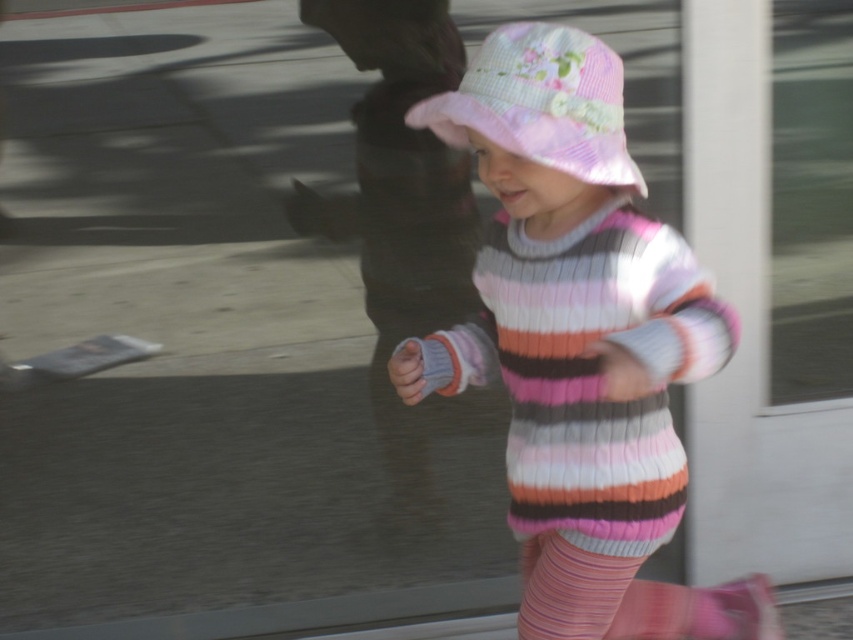
Question: Can you confirm if pink striped sweater at center is thinner than pink seersucker hat at center?

Choices:
 (A) no
 (B) yes

Answer: (A)

Question: Does pink striped sweater at center lie in front of pink seersucker hat at center?

Choices:
 (A) yes
 (B) no

Answer: (A)

Question: Which point appears closest to the camera in this image?

Choices:
 (A) (497, 134)
 (B) (671, 616)

Answer: (A)

Question: Does pink striped sweater at center have a greater width compared to pink seersucker hat at center?

Choices:
 (A) yes
 (B) no

Answer: (A)

Question: Which of the following is the farthest from the observer?

Choices:
 (A) (660, 428)
 (B) (514, 116)

Answer: (A)